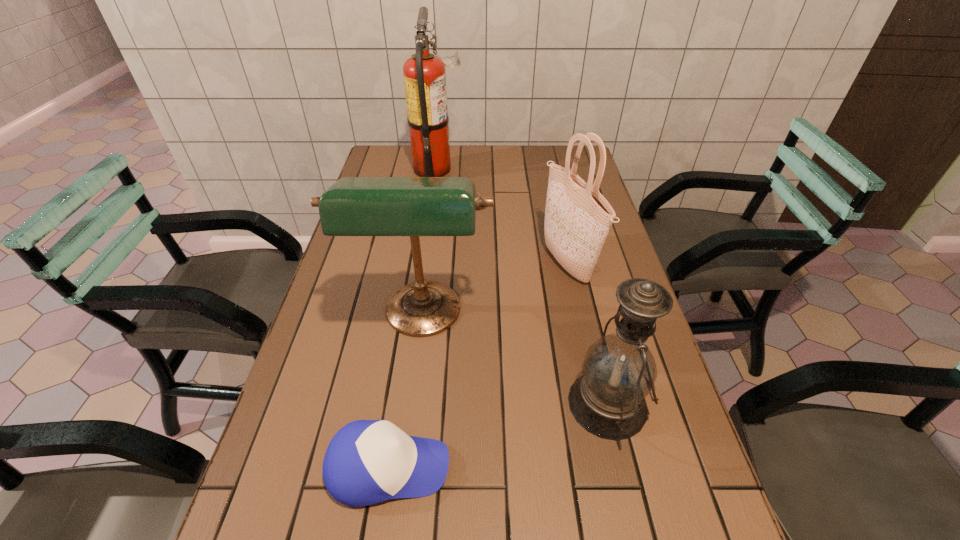
You are a GUI agent. You are given a task and a screenshot of the screen. Output one action in this format:
    pyautogui.click(x=<x>, y=<y>)
    Task: Click on the farthest object
    The height and width of the screenshot is (540, 960).
    Given the screenshot: What is the action you would take?
    point(424,74)

The height and width of the screenshot is (540, 960). In order to click on the tallest object in this screenshot , I will do `click(424, 74)`.

At what (x,y) coordinates should I click in order to perform the action: click on table lamp. Please return your answer as a coordinate pair (x, y). Looking at the image, I should click on (353, 206).

This screenshot has height=540, width=960. I want to click on shopping bag, so click(x=578, y=218).

This screenshot has height=540, width=960. I want to click on oil lamp, so click(x=619, y=370).

In order to click on the shortest object in this screenshot , I will do `click(367, 461)`.

Find the location of `vacant space located from the nozzle of the tallest object`. vacant space located from the nozzle of the tallest object is located at coordinates (476, 169).

Identify the location of free region located above the green lampshade of the table lamp. (399, 494).

Where is `free space located on the front of the shopping bag`? The height and width of the screenshot is (540, 960). free space located on the front of the shopping bag is located at coordinates (585, 343).

The width and height of the screenshot is (960, 540). What are the coordinates of `blank area located on the back of the oil lamp` in the screenshot? It's located at (582, 294).